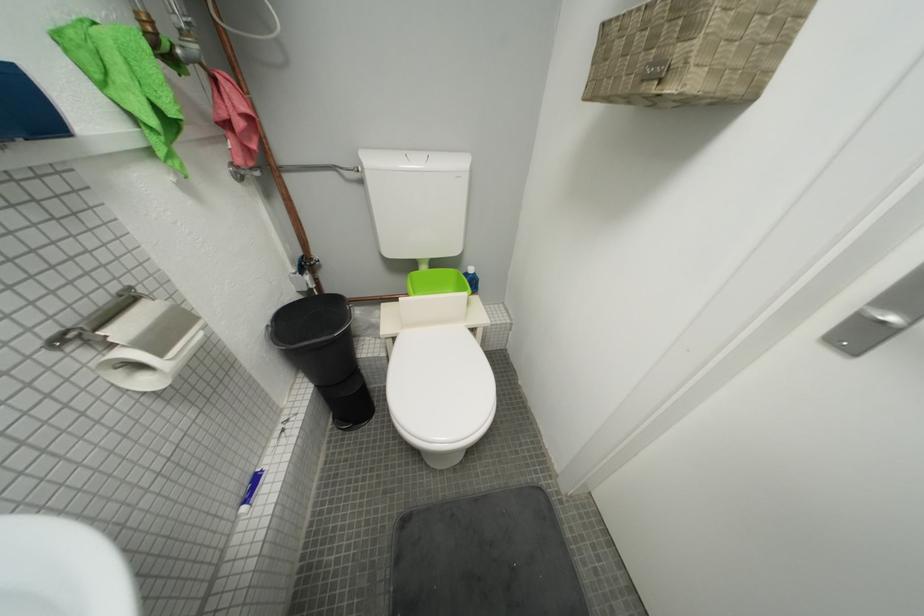
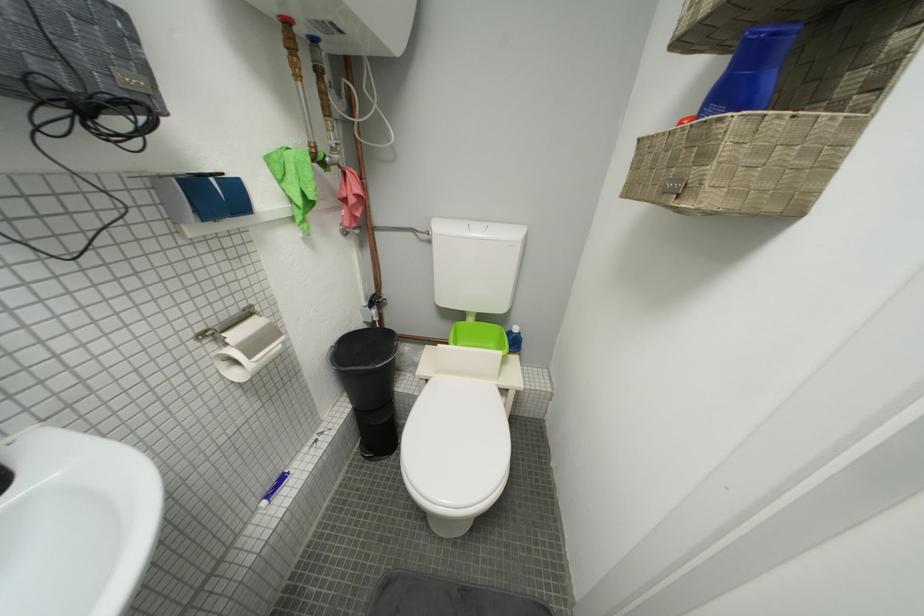
What movement of the cameraman would produce the second image?

The cameraman moved toward right, backward.